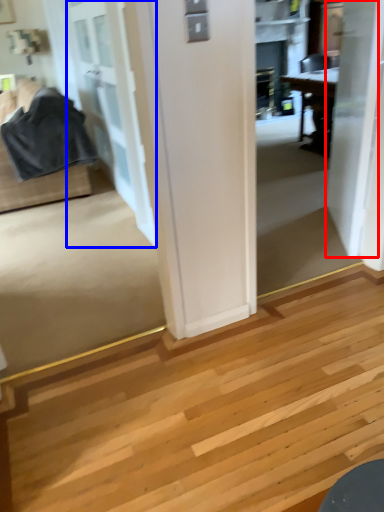
Question: Which point is closer to the camera, door (highlighted by a red box) or door (highlighted by a blue box)?

Choices:
 (A) door
 (B) door

Answer: (A)